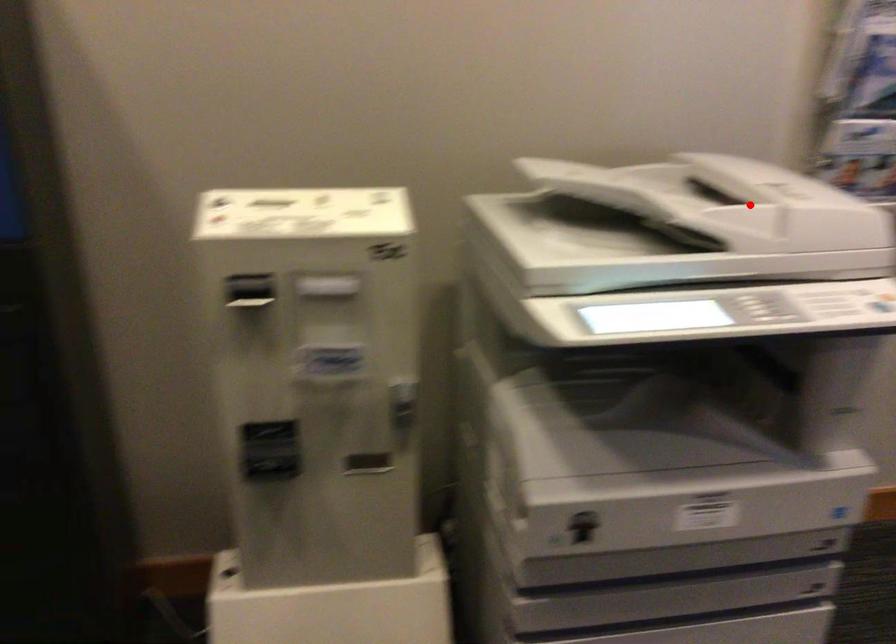
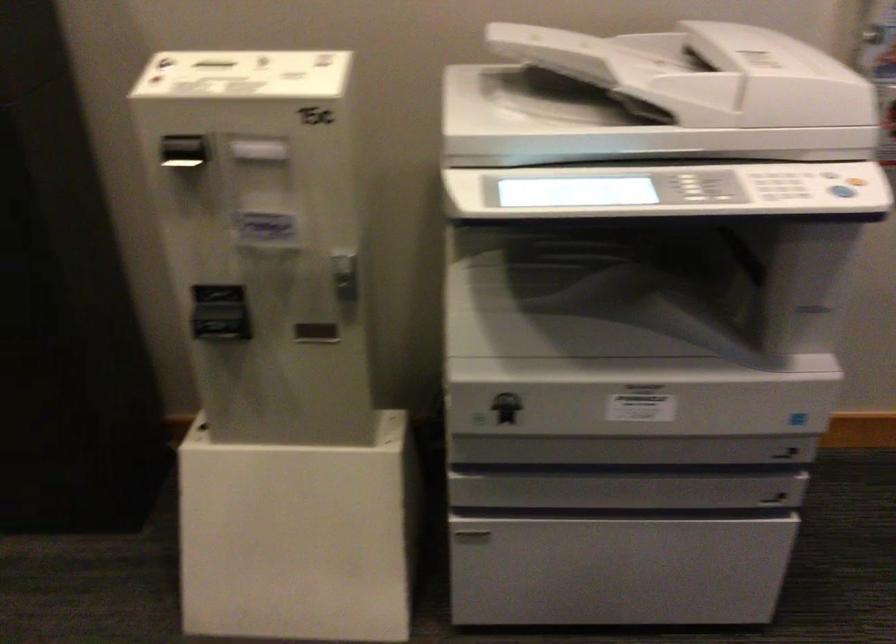
Where in the second image is the point corresponding to the highlighted location from the first image?

(702, 73)